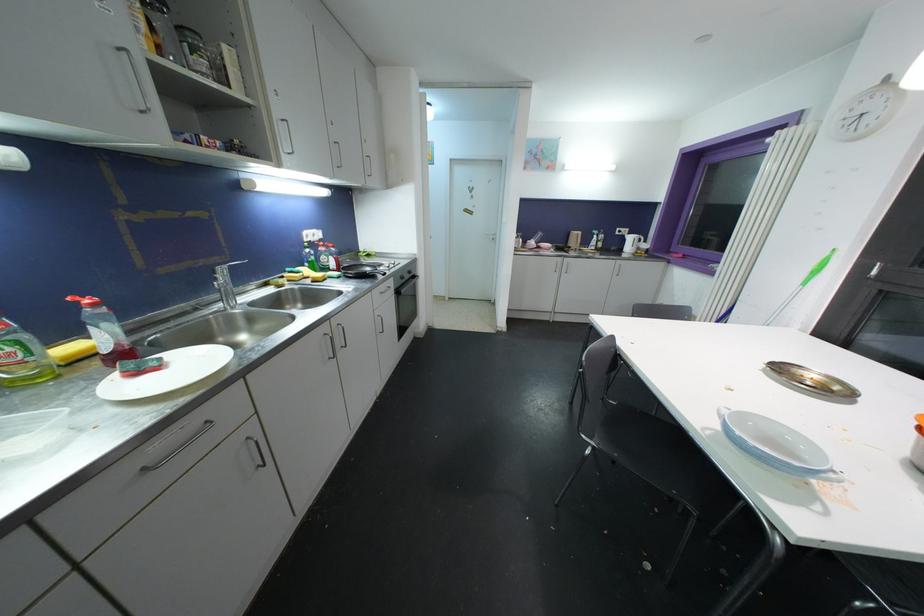
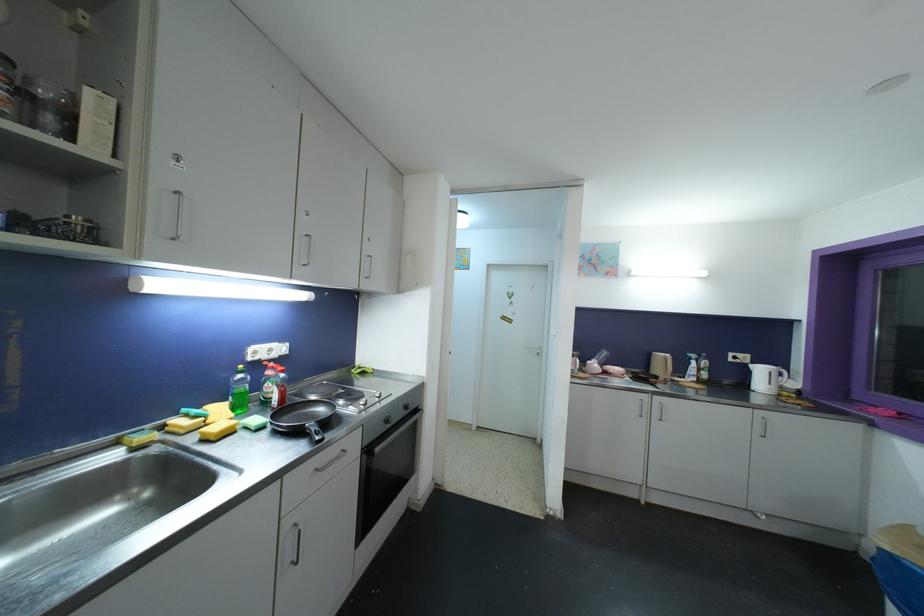
Question: Based on the continuous images, in which direction is the camera rotating? Reply with the corresponding letter.

Choices:
 (A) Left
 (B) Right
 (C) Up
 (D) Down

Answer: (C)